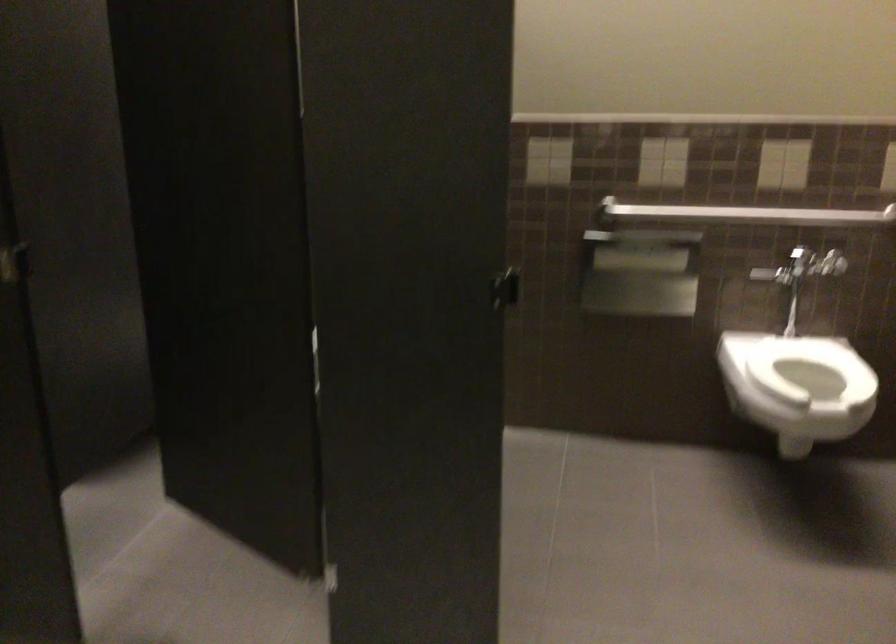
Locate an element on the screen. The height and width of the screenshot is (644, 896). metal grab bar is located at coordinates 745,214.